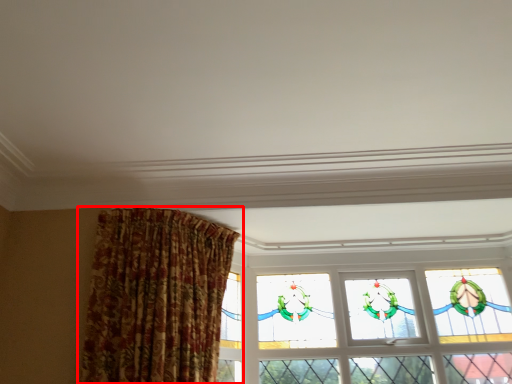
Question: From the image's perspective, what is the correct spatial relationship of curtain (annotated by the red box) in relation to window?

Choices:
 (A) above
 (B) below

Answer: (A)